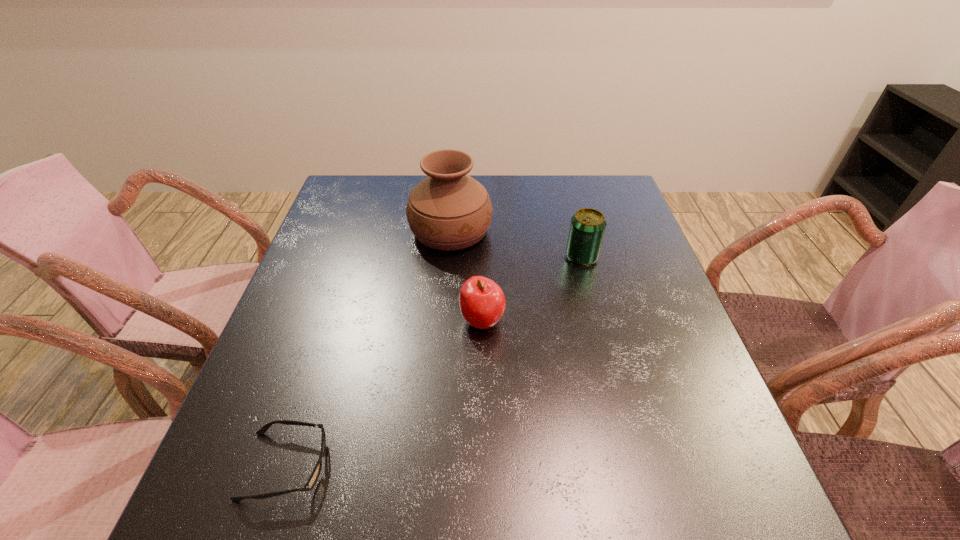
Image resolution: width=960 pixels, height=540 pixels. Find the location of `object that ranks as the closest to the rightmost object`. object that ranks as the closest to the rightmost object is located at coordinates (449, 210).

Locate an element on the screen. This screenshot has width=960, height=540. the second closest object relative to the rightmost object is located at coordinates (482, 303).

Find the location of `vacant area that satisfies the following two spatial constraints: 1. on the front side of the apple; 2. on the front-facing side of the leftmost object`. vacant area that satisfies the following two spatial constraints: 1. on the front side of the apple; 2. on the front-facing side of the leftmost object is located at coordinates (483, 465).

Locate an element on the screen. Image resolution: width=960 pixels, height=540 pixels. free space that satisfies the following two spatial constraints: 1. on the back side of the rightmost object; 2. on the right side of the apple is located at coordinates (482, 257).